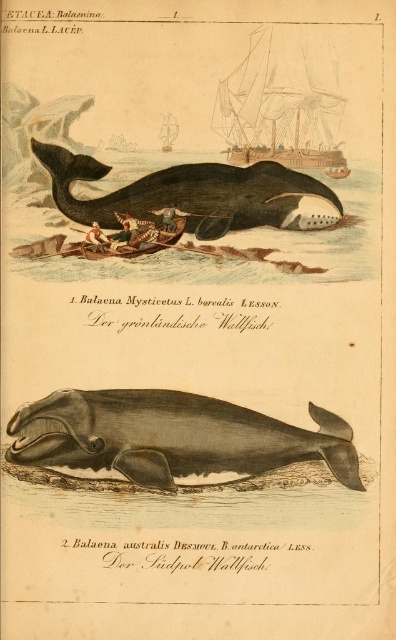
Question: Is gray matte whale at center positioned at the back of wooden ship at upper center?

Choices:
 (A) yes
 (B) no

Answer: (A)

Question: Among these objects, which one is farthest from the camera?

Choices:
 (A) wooden rowboat at center
 (B) gray matte whale at center
 (C) wooden planks boat at upper center
 (D) black matte whale at center

Answer: (A)

Question: Considering the real-world distances, which object is closest to the black matte whale at center?

Choices:
 (A) gray matte whale at center
 (B) wooden ship at upper center
 (C) wooden rowboat at center

Answer: (C)

Question: Can you confirm if black matte whale at center is bigger than wooden rowboat at center?

Choices:
 (A) yes
 (B) no

Answer: (A)

Question: Is black matte whale at center above wooden rowboat at center?

Choices:
 (A) no
 (B) yes

Answer: (B)

Question: Which point is closer to the camera?

Choices:
 (A) (230, 449)
 (B) (211, 221)
 (C) (87, 252)
 (D) (245, 156)

Answer: (A)